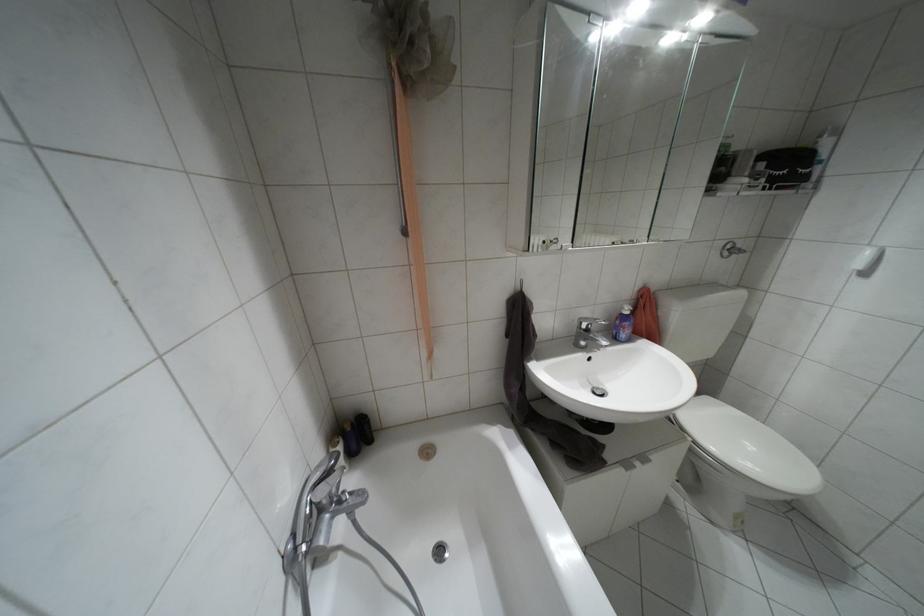
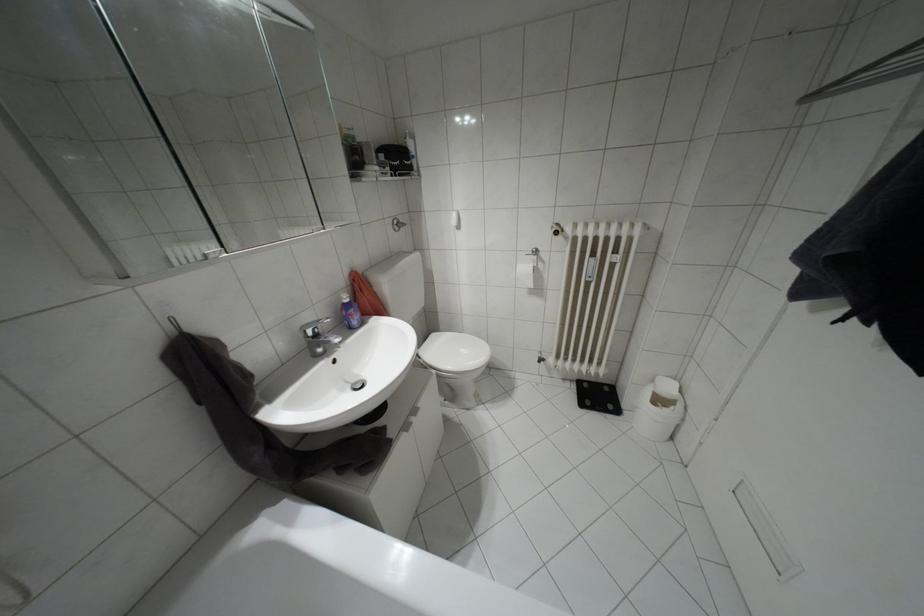
Locate, in the second image, the point that corresponds to (x=626, y=312) in the first image.

(346, 300)